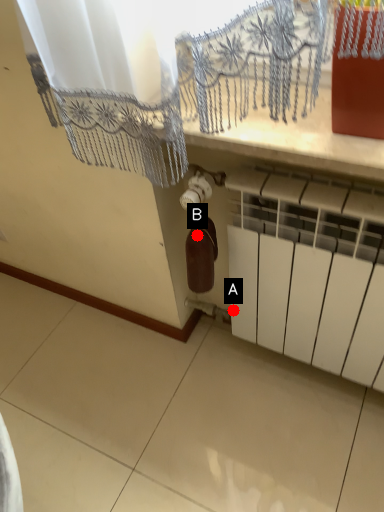
Question: Two points are circled on the image, labeled by A and B beside each circle. Which point appears farthest from the camera in this image?

Choices:
 (A) A is further
 (B) B is further

Answer: (A)